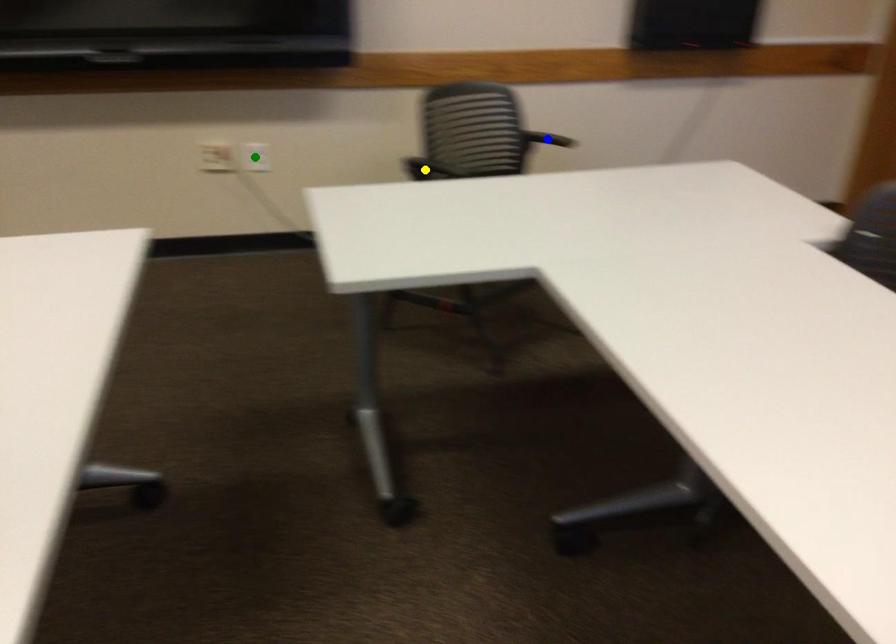
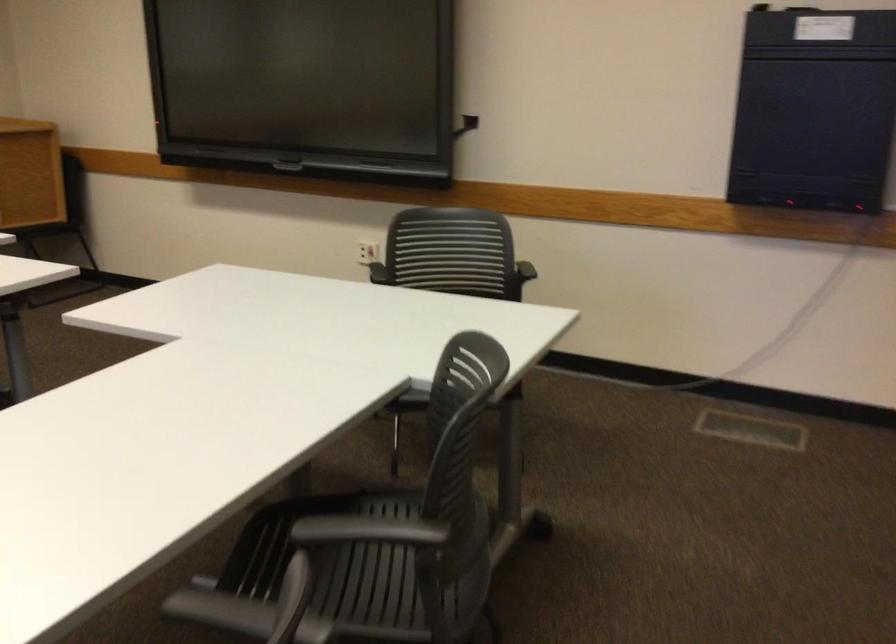
I am providing you with two images of the same scene from different viewpoints. Three points are marked in image1. Which point corresponds to a part or object that is occluded in image2?In image1, three points are marked. Which of them correspond to a part or object that is occluded in image2?Among the three points shown in image1, which one corresponds to a part or object that is no longer visible due to occlusion in image2?

green point, yellow point, blue point